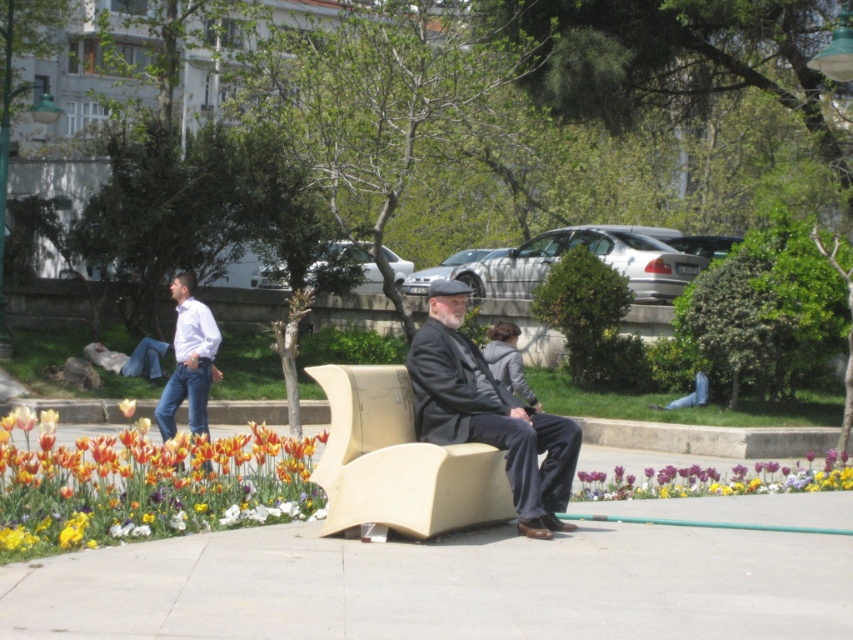
Is vibrant tulip bed at lower left positioned before orange matte tulip at center?

Yes, it is.

Between vibrant tulip bed at lower left and orange matte tulip at center, which one appears on the left side from the viewer's perspective?

orange matte tulip at center is more to the left.

Is point (260, 440) positioned behind point (131, 412)?

That is False.

Locate an element on the screen. This screenshot has width=853, height=640. vibrant tulip bed at lower left is located at coordinates (144, 484).

Who is higher up, vibrant tulip bed at lower left or dark gray fabric coat at center?

dark gray fabric coat at center is higher up.

Image resolution: width=853 pixels, height=640 pixels. What do you see at coordinates (144, 484) in the screenshot?
I see `vibrant tulip bed at lower left` at bounding box center [144, 484].

Image resolution: width=853 pixels, height=640 pixels. In order to click on vibrant tulip bed at lower left in this screenshot , I will do `click(144, 484)`.

Which is below, beige wood armchair at center or dark gray fabric coat at center?

Positioned lower is beige wood armchair at center.

Which is behind, point (357, 490) or point (448, 305)?

The point (448, 305) is more distant.

In order to click on beige wood armchair at center in this screenshot , I will do `click(398, 461)`.